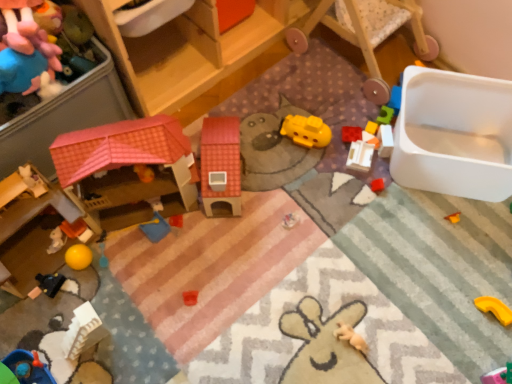
Where is `vacant region to the left of white plastic building at center-right, positioned as the 4th toy in right-to-left order`? vacant region to the left of white plastic building at center-right, positioned as the 4th toy in right-to-left order is located at coordinates (311, 168).